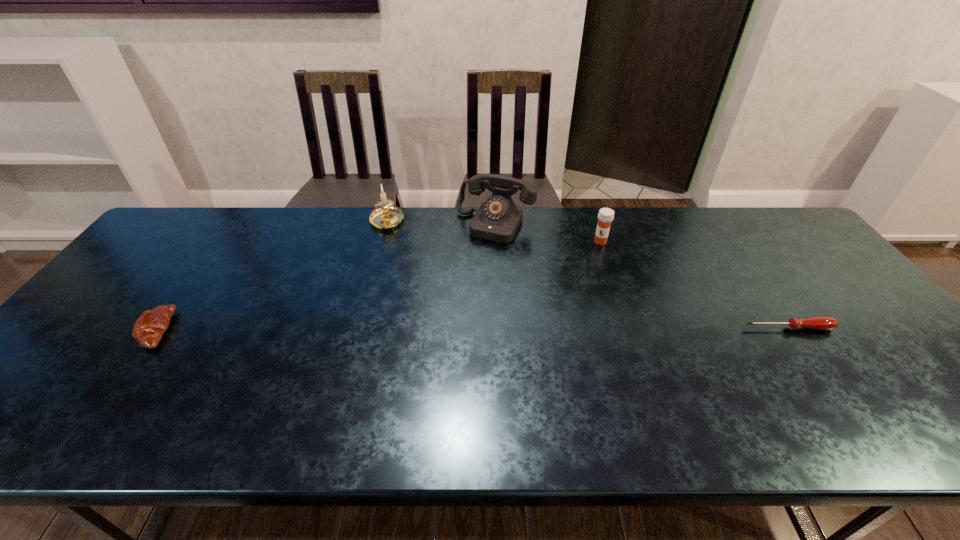
In order to click on crescent roll in this screenshot , I will do `click(149, 327)`.

I want to click on the fourth tallest object, so click(x=149, y=327).

You are a GUI agent. You are given a task and a screenshot of the screen. Output one action in this format:
    pyautogui.click(x=<x>, y=<y>)
    Task: Click on the rightmost object
    This screenshot has width=960, height=540.
    Given the screenshot: What is the action you would take?
    pyautogui.click(x=817, y=323)

Locate an element on the screen. the shortest object is located at coordinates (817, 323).

The image size is (960, 540). Find the location of `telephone`. telephone is located at coordinates (498, 218).

I want to click on the second object from left to right, so click(386, 216).

Find the location of a particular element. the second object from right to left is located at coordinates (606, 215).

Image resolution: width=960 pixels, height=540 pixels. In order to click on medicine in this screenshot , I will do `click(606, 215)`.

Locate an element on the screen. vacant space positioned on the left of the crescent roll is located at coordinates (118, 330).

I want to click on vacant space situated 0.140m at the tip of the shortest object, so click(825, 380).